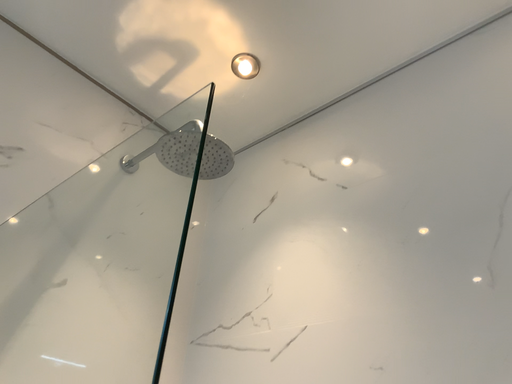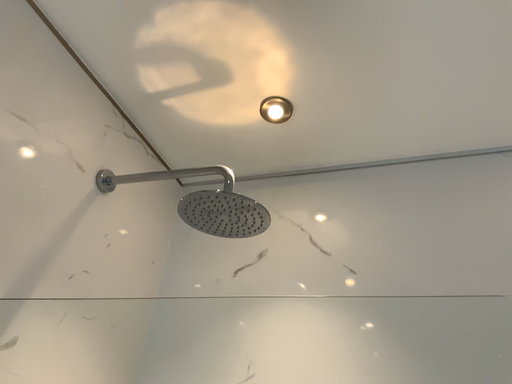
Question: Which way did the camera rotate in the video?

Choices:
 (A) rotated left
 (B) rotated right

Answer: (B)